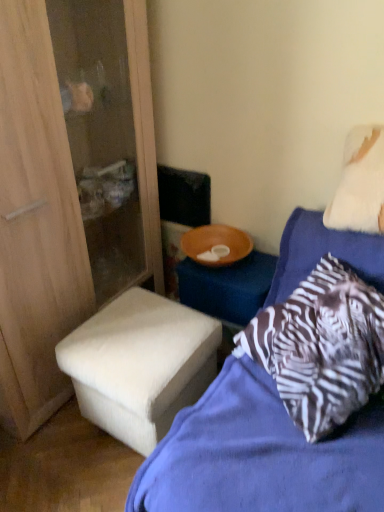
At what (x,y) coordinates should I click in order to perform the action: click on free point above white fabric stool at lower left (from a real-world perspective). Please return your answer as a coordinate pair (x, y). The height and width of the screenshot is (512, 384). Looking at the image, I should click on (138, 331).